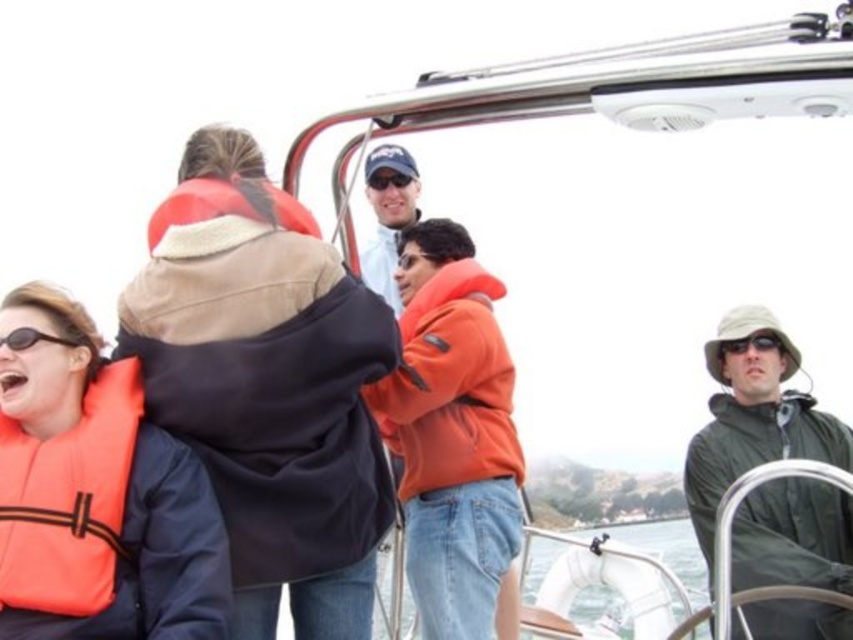
Question: Can you confirm if matte orange life jacket at upper left is positioned to the left of matte black sunglasses at right?

Choices:
 (A) no
 (B) yes

Answer: (B)

Question: Can you confirm if matte black sunglasses at right is bigger than black plastic sunglasses at lower left?

Choices:
 (A) yes
 (B) no

Answer: (B)

Question: Which of the following is the farthest from the observer?

Choices:
 (A) (x=374, y=173)
 (B) (x=86, y=401)
 (C) (x=294, y=198)
 (D) (x=93, y=492)

Answer: (A)

Question: Considering the relative positions of orange fleece jacket at center and matte black sunglasses at right in the image provided, where is orange fleece jacket at center located with respect to matte black sunglasses at right?

Choices:
 (A) below
 (B) above

Answer: (A)

Question: Which point appears farthest from the camera in this image?

Choices:
 (A) (393, 180)
 (B) (28, 348)

Answer: (A)

Question: Which point is closer to the camera?

Choices:
 (A) coord(73,340)
 (B) coord(299,218)
 (C) coord(431,396)
 (D) coord(389,179)

Answer: (A)